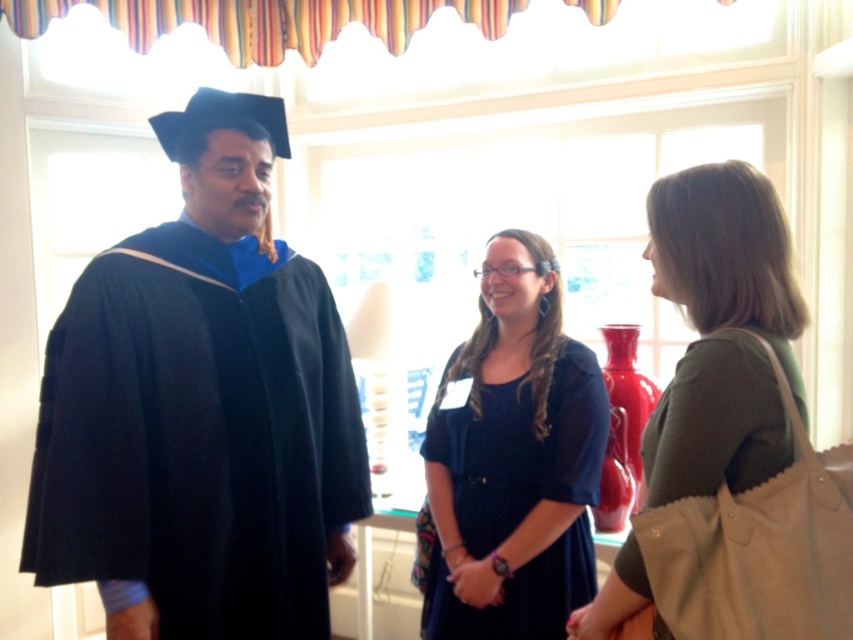
Question: Which of the following is the farthest from the observer?

Choices:
 (A) (227, 296)
 (B) (728, 340)
 (C) (471, 541)

Answer: (C)

Question: Can you confirm if matte black graduation gown at left is positioned above green fabric purse at right?

Choices:
 (A) no
 (B) yes

Answer: (B)

Question: Is matte black dress at center smaller than green fabric purse at right?

Choices:
 (A) no
 (B) yes

Answer: (A)

Question: Which of the following is the farthest from the observer?

Choices:
 (A) matte black dress at center
 (B) green fabric purse at right

Answer: (A)

Question: Can you confirm if matte black graduation gown at left is positioned to the right of matte black dress at center?

Choices:
 (A) yes
 (B) no

Answer: (B)

Question: Estimate the real-world distances between objects in this image. Which object is farther from the matte black dress at center?

Choices:
 (A) matte black graduation gown at left
 (B) green fabric purse at right

Answer: (B)